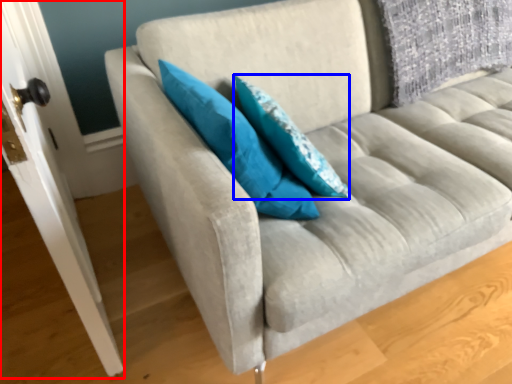
Question: Which of the following is the farthest to the observer, door (highlighted by a red box) or pillow (highlighted by a blue box)?

Choices:
 (A) door
 (B) pillow

Answer: (B)